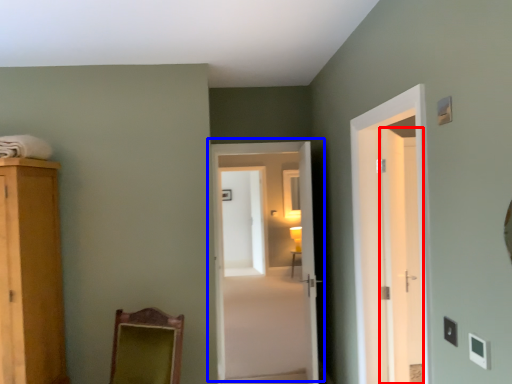
Question: Which of the following is the farthest to the observer, door (highlighted by a red box) or door (highlighted by a blue box)?

Choices:
 (A) door
 (B) door

Answer: (A)